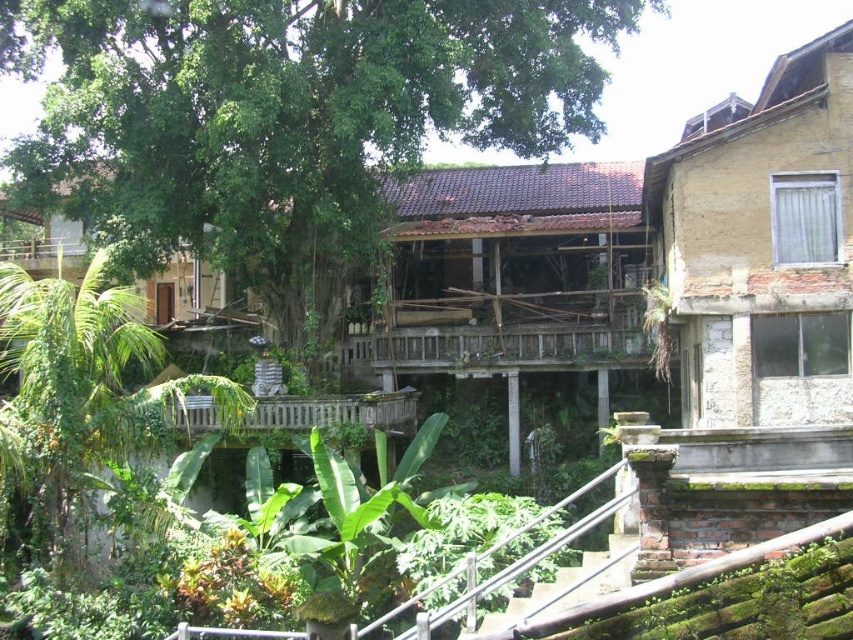
Question: Does wooden at center have a larger size compared to satin silver railing at lower center?

Choices:
 (A) no
 (B) yes

Answer: (A)

Question: Among these points, which one is farthest from the camera?

Choices:
 (A) [x=392, y=406]
 (B) [x=648, y=6]

Answer: (B)

Question: Does green leafy tree at left appear on the right side of satin silver railing at lower center?

Choices:
 (A) no
 (B) yes

Answer: (A)

Question: Which point is closer to the camera taking this photo?

Choices:
 (A) (267, 218)
 (B) (175, 420)
 (C) (1, 422)

Answer: (C)

Question: Which of these objects is positioned closest to the green leafy tree at center?

Choices:
 (A) green leafy tree at left
 (B) satin silver railing at lower center
 (C) wooden at center

Answer: (C)

Question: Is green leafy tree at left wider than wooden at center?

Choices:
 (A) no
 (B) yes

Answer: (A)